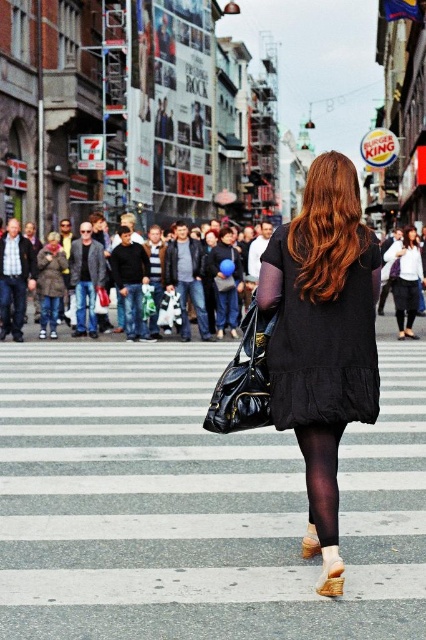
Question: Which of the following is the closest to the observer?

Choices:
 (A) (80, 148)
 (B) (370, 337)
 (C) (311, 540)

Answer: (C)

Question: Estimate the real-world distances between objects in this image. Which object is farther from the metallic silver sign at upper center?

Choices:
 (A) black matte dress at center
 (B) black sheer tights at lower center
 (C) metallic silver sign at upper left

Answer: (B)

Question: Which point appears farthest from the camera in this image?

Choices:
 (A) (98, 157)
 (B) (325, 580)
 (C) (198, 284)
 (D) (95, 138)

Answer: (A)

Question: Does black sheer tights at lower center appear over leather beige boot at lower center?

Choices:
 (A) no
 (B) yes

Answer: (B)

Question: Is jeans at center smaller than metallic silver sign at upper center?

Choices:
 (A) no
 (B) yes

Answer: (A)

Question: Is matte black clothing at center smaller than metallic silver sign at upper center?

Choices:
 (A) yes
 (B) no

Answer: (A)